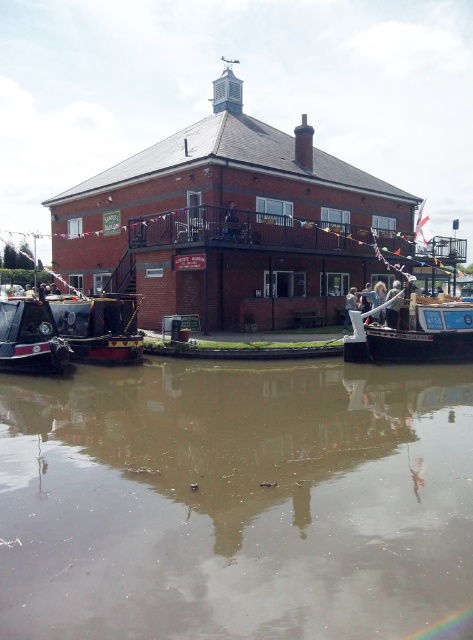
What do you see at coordinates (414, 333) in the screenshot? I see `wooden polished boat at center` at bounding box center [414, 333].

Who is more forward, (410, 346) or (36, 326)?

Positioned in front is point (36, 326).

Where is `wooden polished boat at center`? wooden polished boat at center is located at coordinates (414, 333).

Where is `brown murky water at center`? brown murky water at center is located at coordinates (235, 500).

Is point (26, 582) less distant than point (357, 310)?

Yes, point (26, 582) is in front of point (357, 310).

Does point (67, 433) lie in front of point (399, 330)?

Yes.

This screenshot has height=640, width=473. I want to click on brown murky water at center, so click(x=235, y=500).

Is matte black boat at left smaller than matte black barge at left?

No, matte black boat at left is not smaller than matte black barge at left.

Does matte black boat at left appear under matte black barge at left?

No, matte black boat at left is not below matte black barge at left.

What do you see at coordinates (99, 330) in the screenshot? I see `matte black boat at left` at bounding box center [99, 330].

Identify the location of matte black boat at left. This screenshot has width=473, height=640. (99, 330).